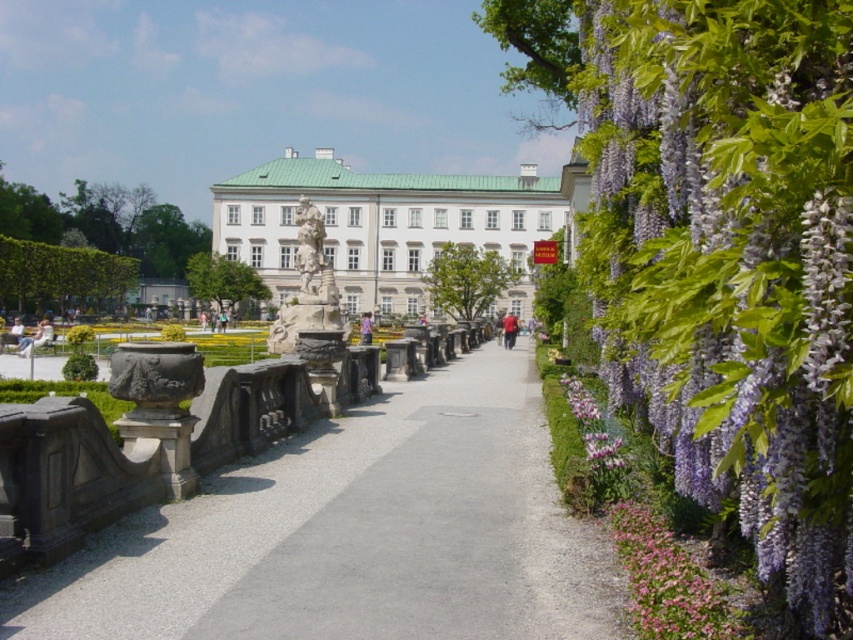
You are standing at the entrance of the garden and want to take a photo of the purple silky wisteria at right. Which direction should you face to capture it in your view?

The purple silky wisteria at right is located at point 0.406 on the x and 0.860 on the y, so you should face towards the right side of the garden pathway to capture it in your view.

You are a visitor approaching the white glossy palace at center through the garden pathway. As you walk towards it, you notice the green leafy hedge at left. Which object appears bigger in your view?

The white glossy palace at center appears bigger in your view because it has a larger size compared to the green leafy hedge at left.